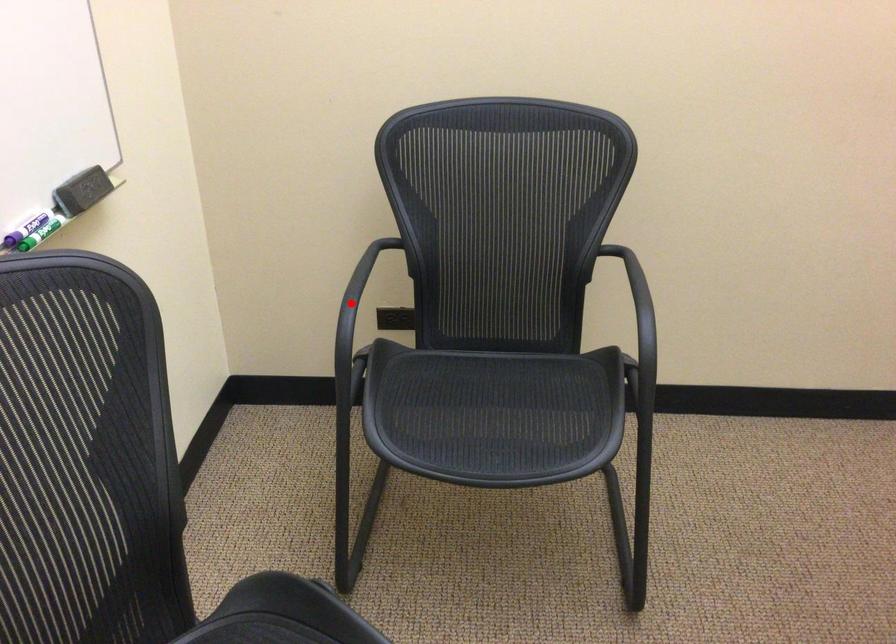
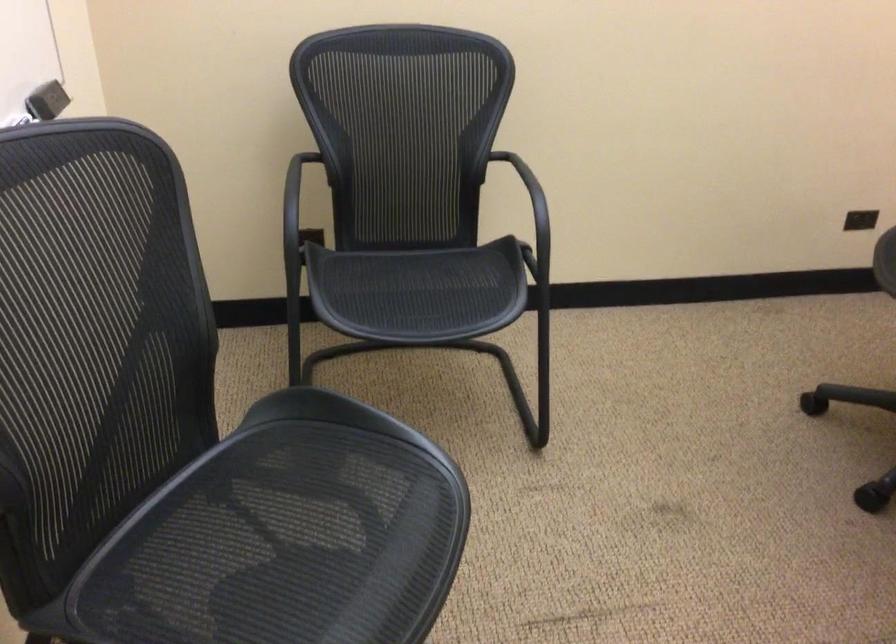
Question: I am providing you with two images of the same scene from different viewpoints. In image1, a red point is highlighted. Considering the same 3D point in image2, which of the following is correct?

Choices:
 (A) It is closer
 (B) It is farther

Answer: (B)